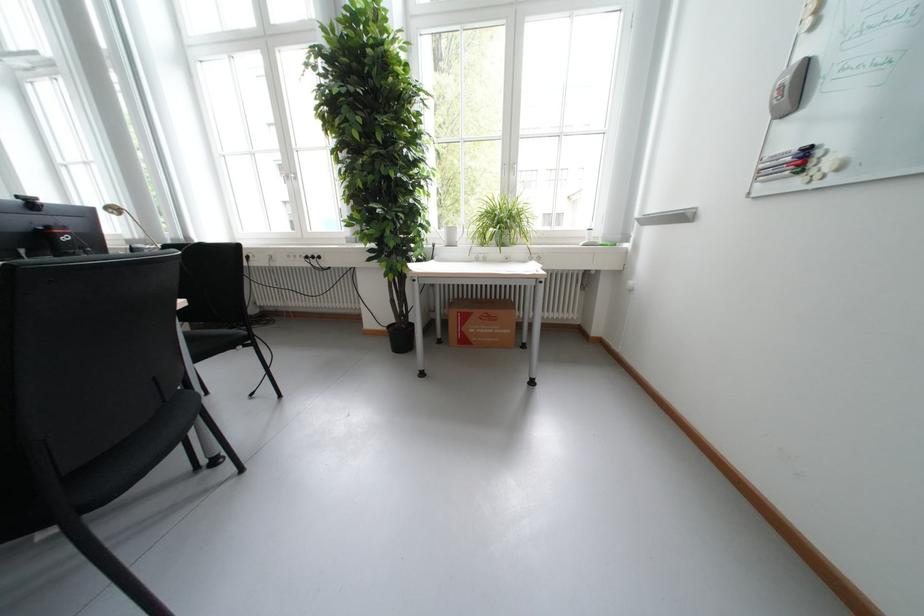
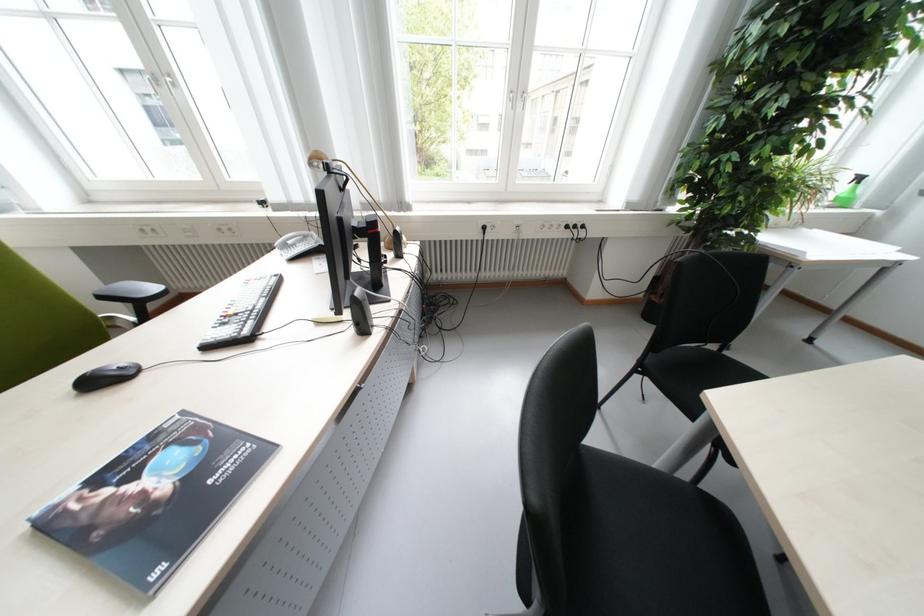
Question: Which direction would the cameraman need to move to produce the second image? Reply with the corresponding letter.

Choices:
 (A) Left
 (B) Right
 (C) Forward
 (D) Backward

Answer: (A)